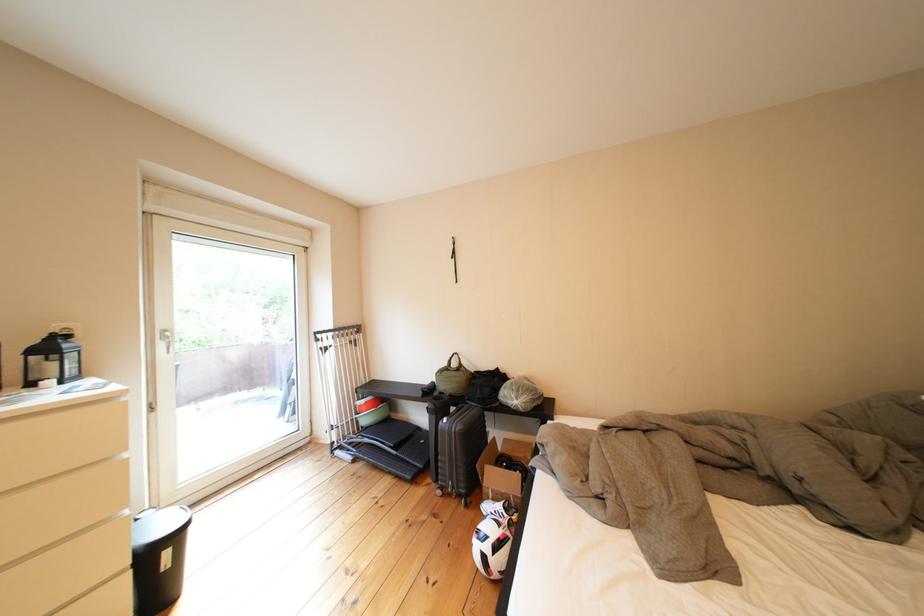
The location [454,257] corresponds to which object?

It refers to a black wall strap.